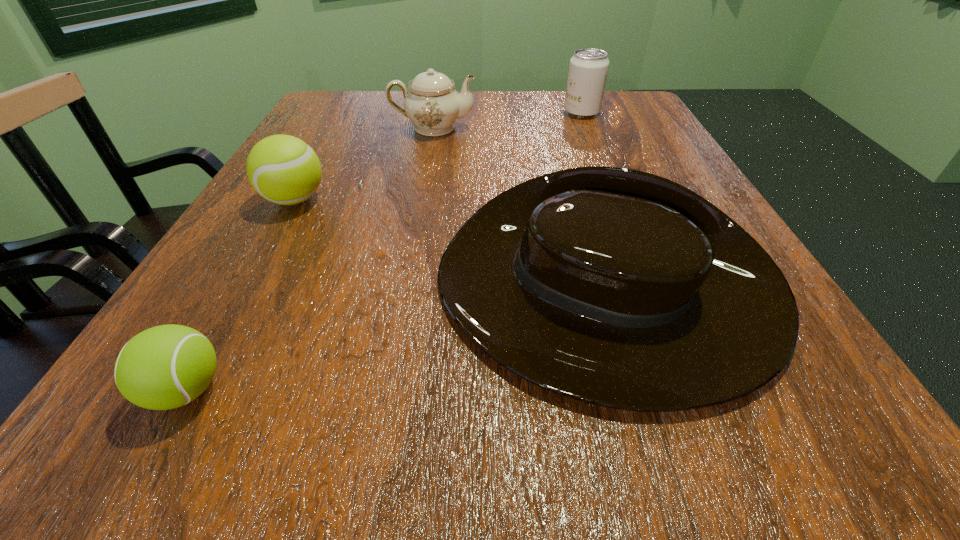
Find the location of `soda can`. soda can is located at coordinates (588, 68).

You are a GUI agent. You are given a task and a screenshot of the screen. Output one action in this format:
    pyautogui.click(x=<x>, y=<y>)
    Task: Click on the chinaware
    The image size is (960, 540).
    Given the screenshot: What is the action you would take?
    pyautogui.click(x=433, y=105)

I want to click on the taller tennis ball, so click(x=283, y=169).

Locate an element on the screen. cowboy hat is located at coordinates (616, 287).

Where is `the shorter tennis ball`? the shorter tennis ball is located at coordinates (164, 367).

Find the location of a particular element. This screenshot has width=960, height=540. the shortest object is located at coordinates (164, 367).

The height and width of the screenshot is (540, 960). I want to click on free space located on the front of the soda can, so click(x=608, y=176).

You are a GUI agent. You are given a task and a screenshot of the screen. Output one action in this format:
    pyautogui.click(x=<x>, y=<y>)
    Task: Click on the free space located at the spout of the chinaware
    Image resolution: width=960 pixels, height=540 pixels.
    Given the screenshot: What is the action you would take?
    pyautogui.click(x=528, y=127)

Where is `free space located on the front of the taller tennis ball`? free space located on the front of the taller tennis ball is located at coordinates (202, 369).

Identify the location of vacant space situated on the left of the cowboy hat. This screenshot has height=540, width=960. (334, 295).